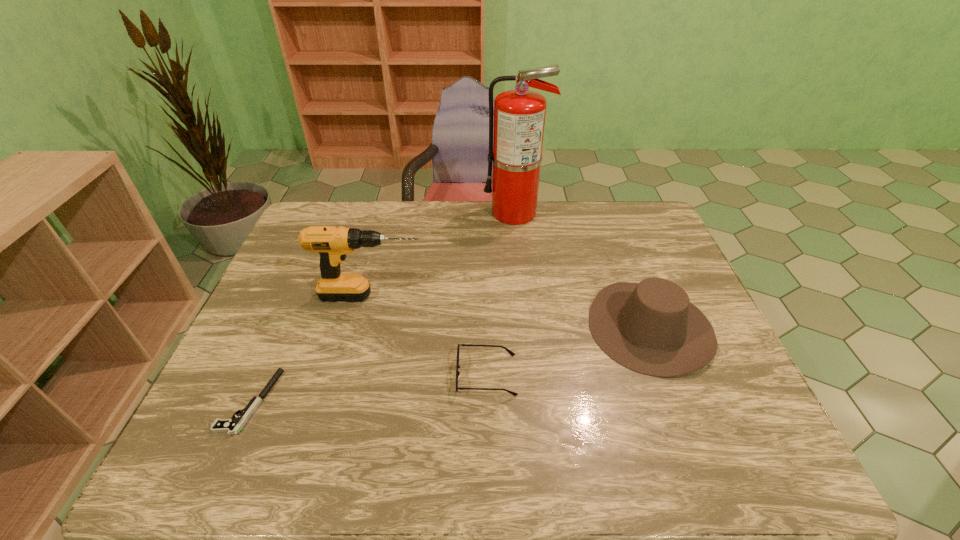
The width and height of the screenshot is (960, 540). I want to click on pistol situated at the left edge, so click(x=232, y=426).

The height and width of the screenshot is (540, 960). Identify the location of object at the right edge. (651, 328).

The height and width of the screenshot is (540, 960). Identify the location of object present at the near left corner. (232, 426).

In the image, there is a desktop. At what (x,y) coordinates should I click in order to perform the action: click on free space at the far edge. Please return your answer as a coordinate pair (x, y). The image size is (960, 540). Looking at the image, I should click on (607, 214).

The width and height of the screenshot is (960, 540). In the image, there is a desktop. Identify the location of vacant space at the near edge. (681, 450).

In the image, there is a desktop. At what (x,y) coordinates should I click in order to perform the action: click on vacant space at the left edge. Please return your answer as a coordinate pair (x, y). Looking at the image, I should click on (291, 306).

In the image, there is a desktop. Where is `vacant space at the far right corner`? Image resolution: width=960 pixels, height=540 pixels. vacant space at the far right corner is located at coordinates (646, 229).

At what (x,y) coordinates should I click in order to perform the action: click on empty space that is in between the spectacles and the leftmost object. Please return your answer as a coordinate pair (x, y). This screenshot has width=960, height=540. Looking at the image, I should click on (368, 388).

Image resolution: width=960 pixels, height=540 pixels. I want to click on empty space that is in between the fourth shortest object and the pistol, so click(x=310, y=349).

Where is `vacant area that lies between the pistol and the third shortest object`? The image size is (960, 540). vacant area that lies between the pistol and the third shortest object is located at coordinates (450, 364).